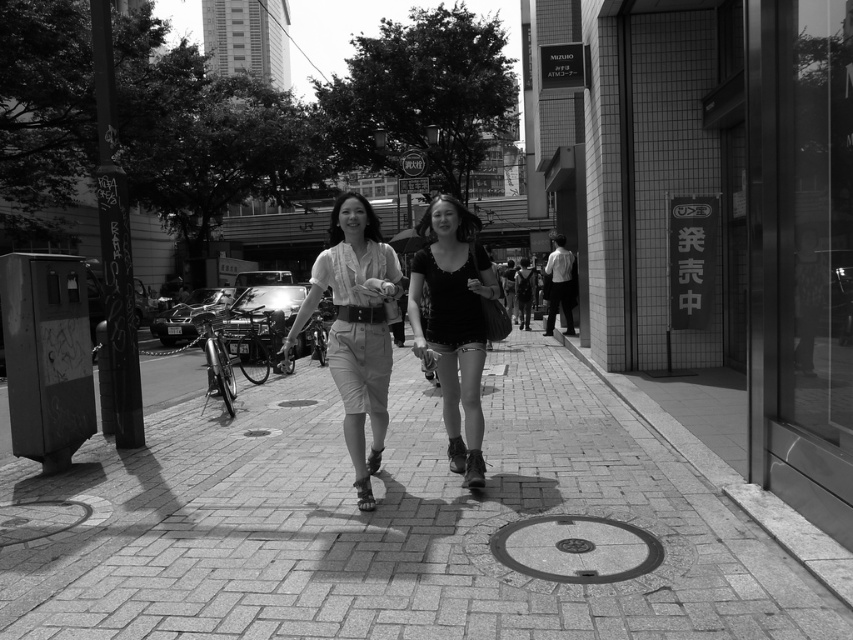
Can you confirm if matte white blouse at center is shorter than matte black shirt at center?

Yes.

How distant is matte white blouse at center from matte black shirt at center?

The distance of matte white blouse at center from matte black shirt at center is 23.50 inches.

Locate an element on the screen. This screenshot has height=640, width=853. matte white blouse at center is located at coordinates (357, 326).

Does point (692, 572) lie behind point (450, 212)?

No, it is not.

Who is higher up, brick pavement at center or matte black shirt at center?

matte black shirt at center

This screenshot has height=640, width=853. Identify the location of brick pavement at center. (392, 525).

Is brick pavement at center above matte white blouse at center?

No.

Between brick pavement at center and matte white blouse at center, which one appears on the left side from the viewer's perspective?

From the viewer's perspective, brick pavement at center appears more on the left side.

Who is more distant from viewer, [317,472] or [363,401]?

The point [317,472] is behind.

Image resolution: width=853 pixels, height=640 pixels. Identify the location of brick pavement at center. (392, 525).